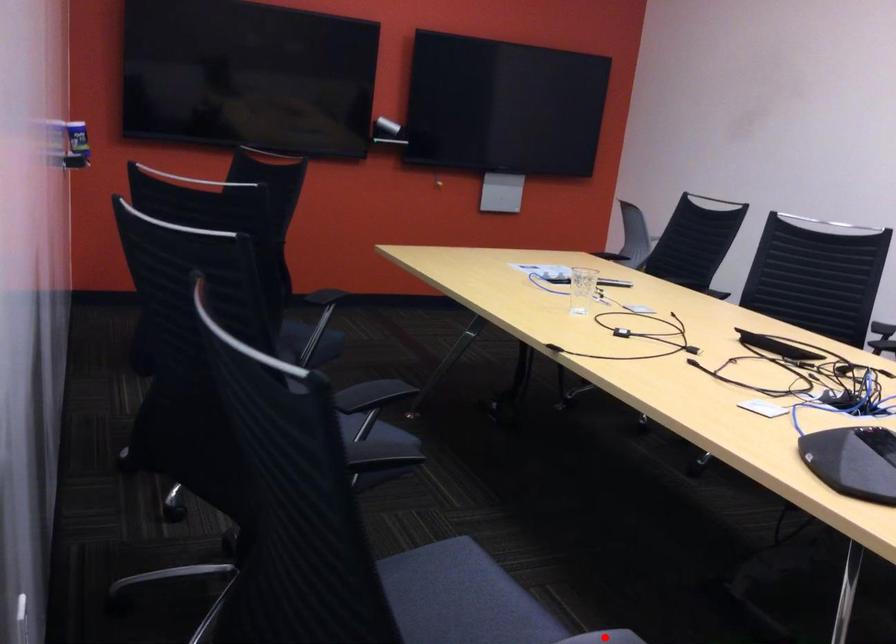
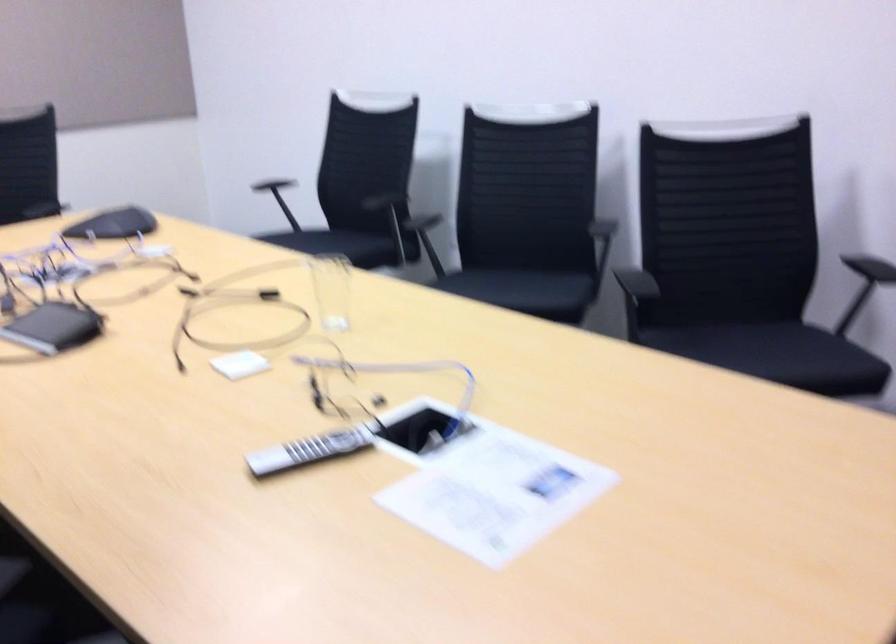
Question: I am providing you with two images of the same scene from different viewpoints. A red point is marked on the first image. At the location where the point appears in image 1, is it still visible in image 2?

Choices:
 (A) Yes
 (B) No

Answer: (B)